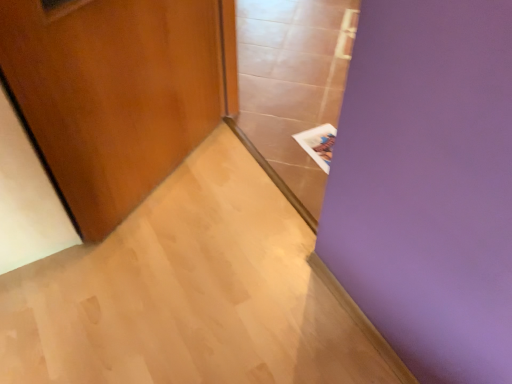
Identify the location of vacant area on the back side of transparent glass door at center. (289, 99).